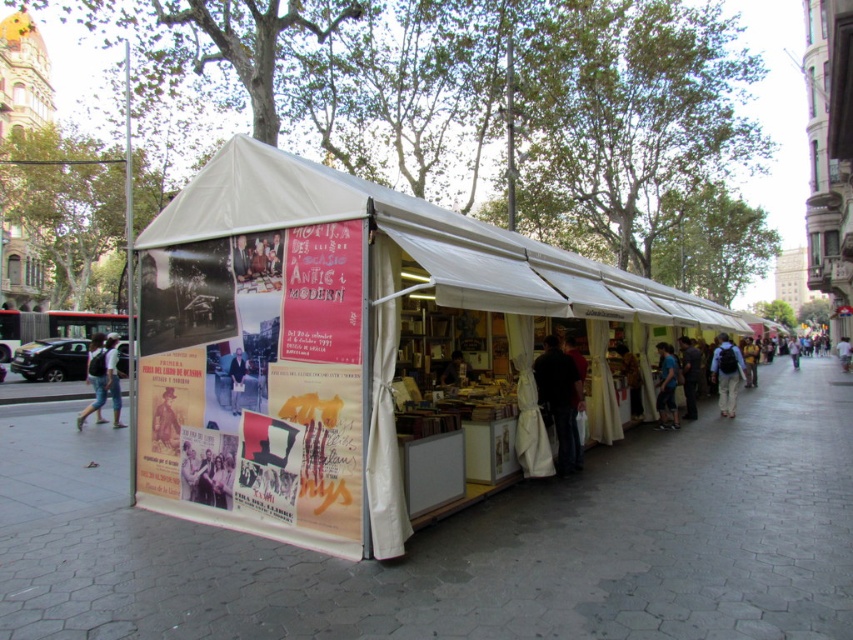
Question: Is gray cobblestone pavement at lower left thinner than light blue jeans at left?

Choices:
 (A) no
 (B) yes

Answer: (A)

Question: Based on their relative distances, which object is farther from the dark blue jeans at lower center?

Choices:
 (A) light blue jeans at left
 (B) dark clothing at center

Answer: (A)

Question: Which of these objects is positioned closest to the matte black book at center?

Choices:
 (A) white fabric tent at center
 (B) gray cobblestone pavement at lower left
 (C) dark clothing at center

Answer: (C)

Question: Can you confirm if denim shorts at left is thinner than matte black book at center?

Choices:
 (A) yes
 (B) no

Answer: (B)

Question: Observing the image, what is the correct spatial positioning of dark clothing at center in reference to khaki pants at center?

Choices:
 (A) below
 (B) above

Answer: (B)

Question: Among these points, which one is farthest from the camera?

Choices:
 (A) (796, 339)
 (B) (688, 387)
 (C) (665, 371)
 (D) (543, 620)

Answer: (A)